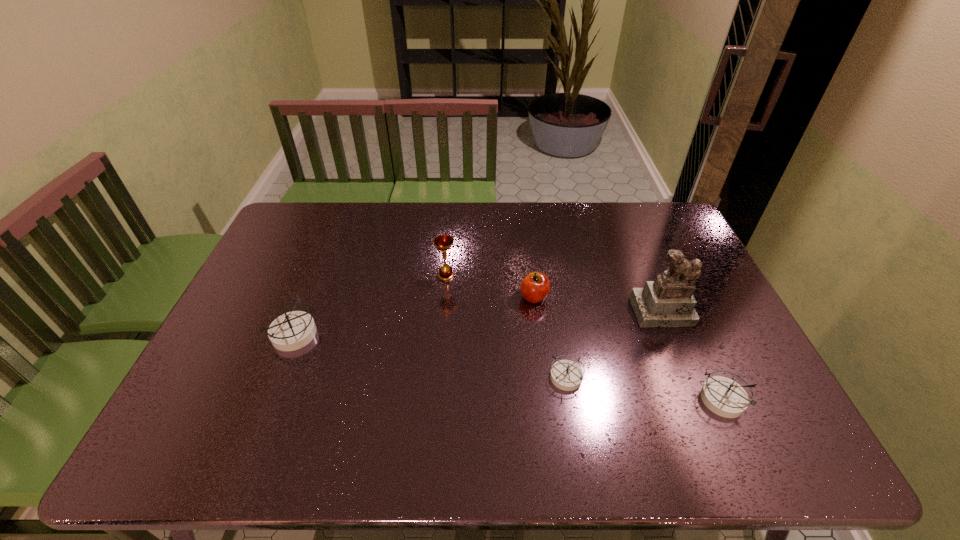
The image size is (960, 540). Find the location of `vacant space at the far edge`. vacant space at the far edge is located at coordinates (400, 217).

Where is `vacant area at the near edge`? The image size is (960, 540). vacant area at the near edge is located at coordinates (444, 415).

Locate an element on the screen. This screenshot has width=960, height=540. free region at the left edge is located at coordinates (275, 296).

Identify the location of vacant position at the right edge of the desktop. This screenshot has height=540, width=960. (721, 346).

Where is `free point at the near left corner`? The height and width of the screenshot is (540, 960). free point at the near left corner is located at coordinates (x=212, y=393).

The height and width of the screenshot is (540, 960). I want to click on vacant area at the far right corner, so tap(631, 211).

The image size is (960, 540). I want to click on vacant region between the shortest compass and the chalice, so click(x=506, y=326).

Identify the location of unoccupied area between the leftmost object and the chalice. (370, 305).

Identify the location of empty space that is in between the farthest object and the apple. The image size is (960, 540). (490, 286).

Where is `empty location between the second shortest object and the chalice`? The width and height of the screenshot is (960, 540). empty location between the second shortest object and the chalice is located at coordinates (584, 338).